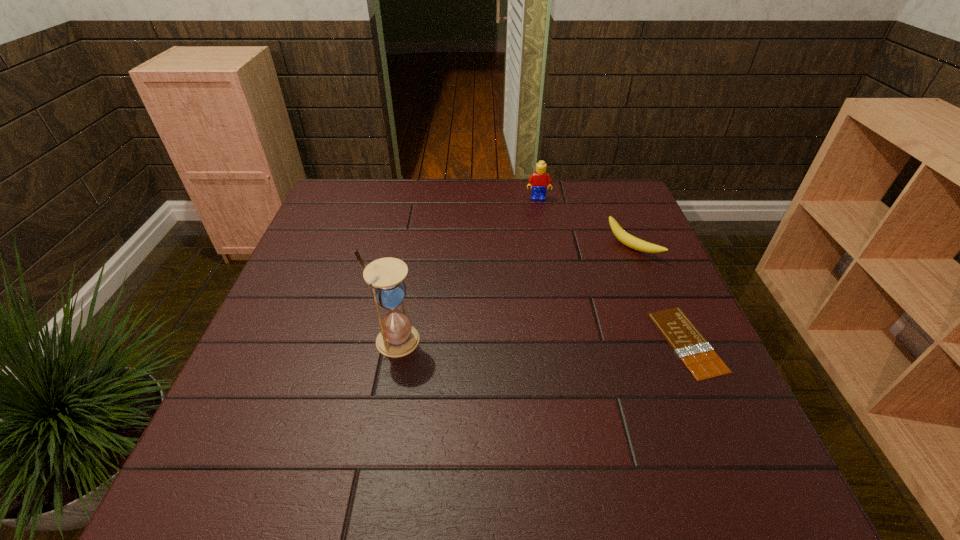
You are a GUI agent. You are given a task and a screenshot of the screen. Output one action in this format:
    pyautogui.click(x=<x>, y=<y>)
    Task: Click on the vacant space on the desktop that is between the leftmost object and the chocolate bar and is positioned on the front-facing side of the Lego
    
    Given the screenshot: What is the action you would take?
    pyautogui.click(x=546, y=341)

The height and width of the screenshot is (540, 960). I want to click on free space on the desktop that is between the tallest object and the chocolate bar and is positioned on the upward curve of the second farthest object, so click(500, 341).